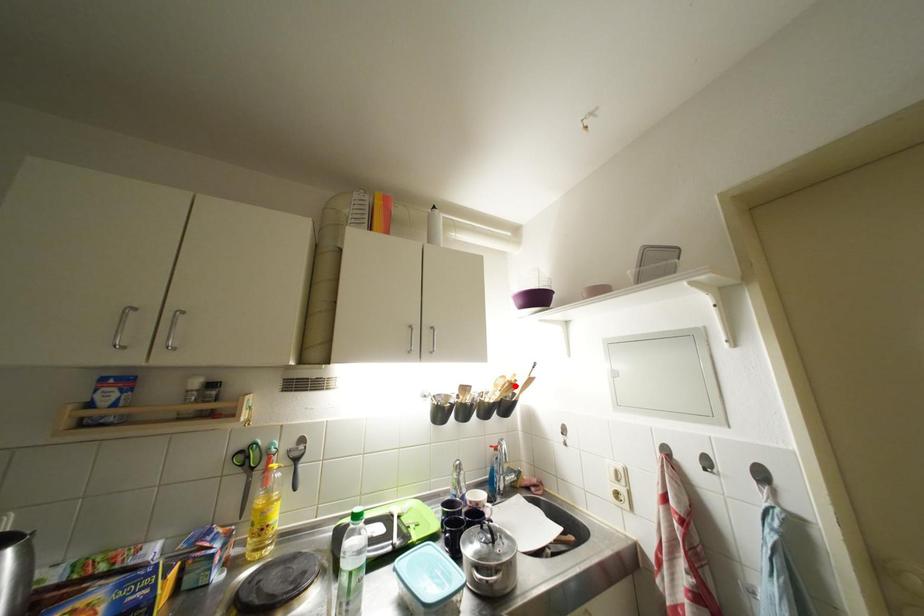
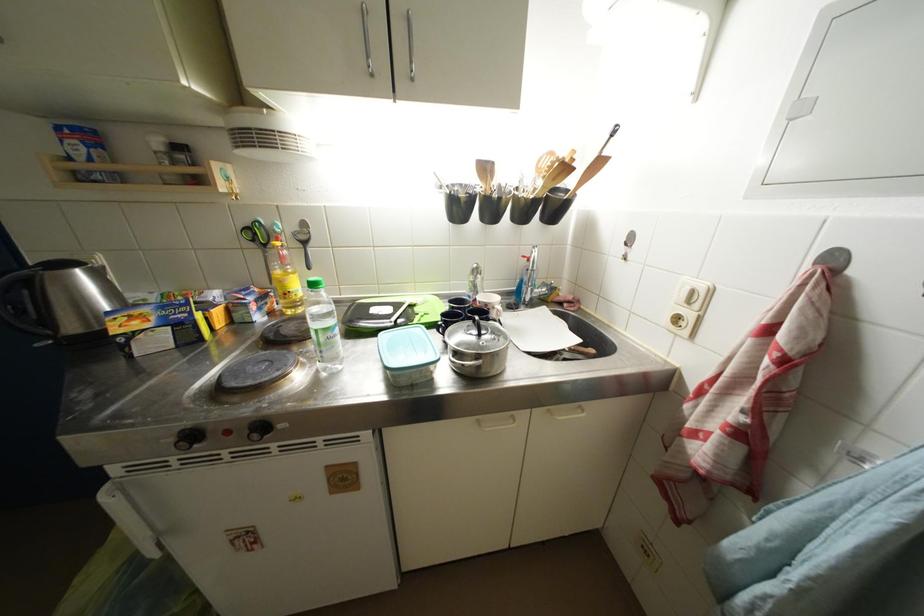
In the second image, find the point that corresponds to the highlighted location in the first image.

(565, 164)